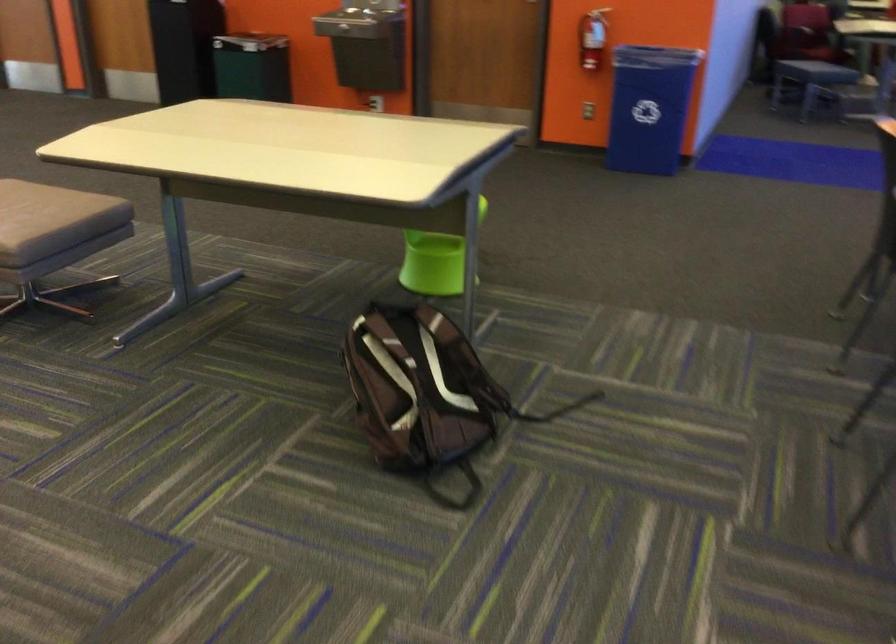
Where would you squeez the fire extinguisher handle? Please return your answer as a coordinate pair (x, y).

(598, 15)